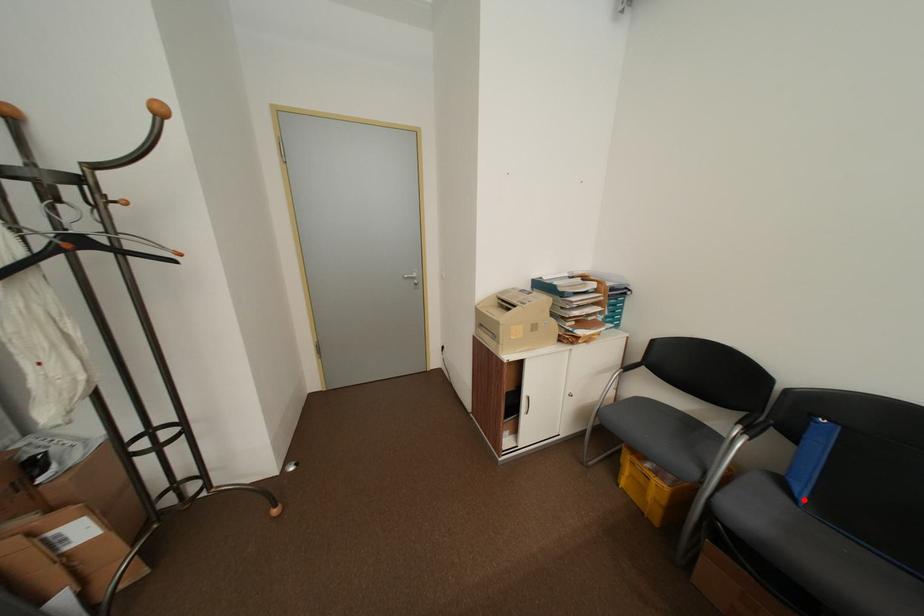
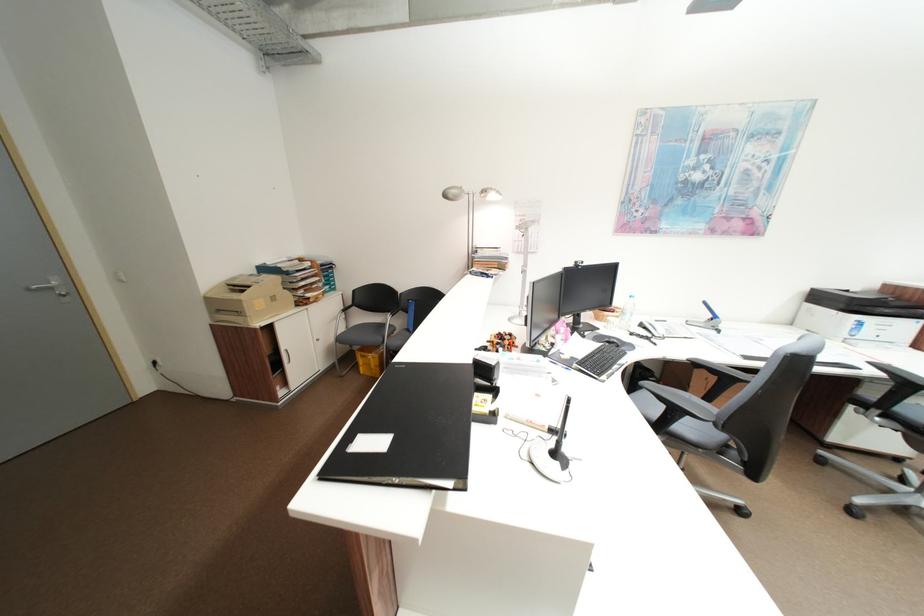
Question: I am providing you with two images of the same scene from different viewpoints. A red point is marked on the first image. Can you still see the location of the red point in image 2?

Choices:
 (A) Yes
 (B) No

Answer: (B)